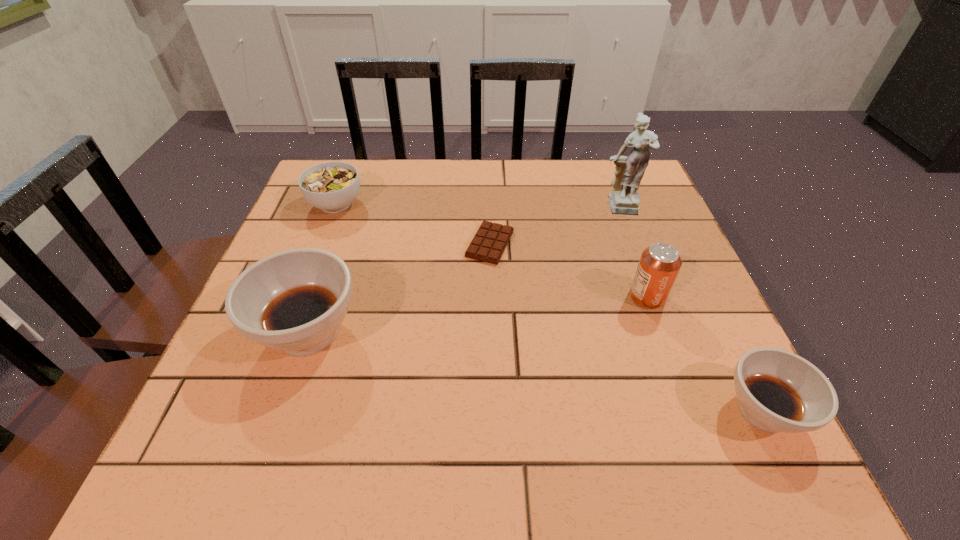
Locate an element on the screen. The height and width of the screenshot is (540, 960). free space between the can and the tallest soup bowl is located at coordinates (478, 314).

Locate an element on the screen. The image size is (960, 540). unoccupied position between the figurine and the farthest soup bowl is located at coordinates (477, 206).

Find the location of a particular element. free point between the rightmost soup bowl and the third farthest object is located at coordinates (627, 327).

You are a GUI agent. You are given a task and a screenshot of the screen. Output one action in this format:
    pyautogui.click(x=<x>, y=<y>)
    Task: Click on the vacant point located between the tallest soup bowl and the can
    
    Given the screenshot: What is the action you would take?
    pyautogui.click(x=478, y=314)

Locate an element on the screen. The image size is (960, 540). unoccupied area between the tallest soup bowl and the rightmost soup bowl is located at coordinates (536, 372).

Locate an element on the screen. free spot between the farthest soup bowl and the rightmost soup bowl is located at coordinates (549, 307).

You are a GUI agent. You are given a task and a screenshot of the screen. Output one action in this format:
    pyautogui.click(x=<x>, y=<y>)
    Task: Click on the vacant point located between the farthest soup bowl and the rightmost soup bowl
    This screenshot has height=540, width=960.
    Given the screenshot: What is the action you would take?
    pyautogui.click(x=549, y=307)

You are a GUI agent. You are given a task and a screenshot of the screen. Output one action in this format:
    pyautogui.click(x=<x>, y=<y>)
    Task: Click on the vacant point located between the can and the rightmost soup bowl
    
    Given the screenshot: What is the action you would take?
    pyautogui.click(x=705, y=354)

Locate an element on the screen. The width and height of the screenshot is (960, 540). object identified as the second closest to the can is located at coordinates (624, 199).

Find the location of a particular element. The image size is (960, 540). the fifth closest object to the tallest soup bowl is located at coordinates (778, 391).